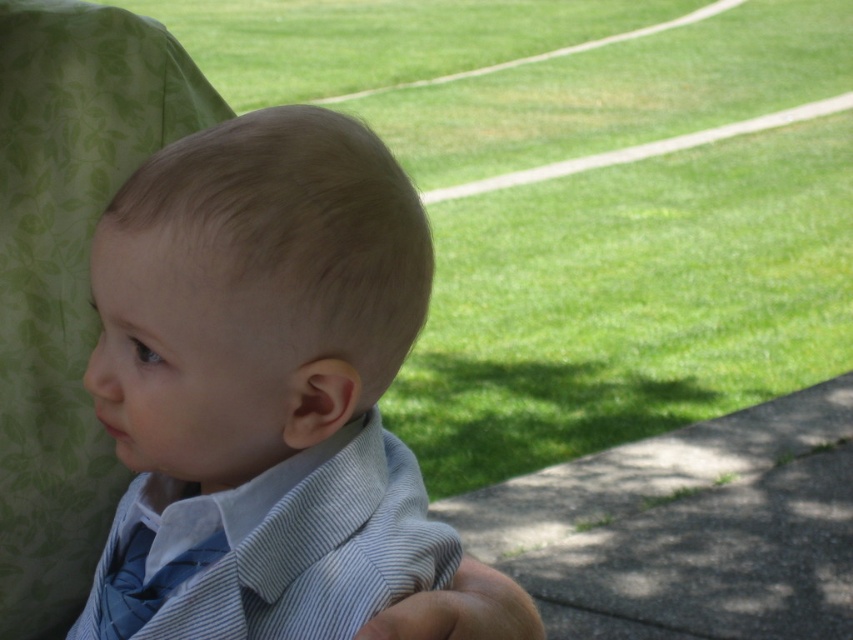
Based on the scene description, which object is positioned higher on the child? The light brown hair at center or the blue striped dress shirt at center?

The light brown hair at center is taller than the blue striped dress shirt at center.

You are a tailor who needs to adjust the blue striped dress shirt at center and the blue striped tie at lower left. Which item requires more horizontal space when laid flat?

The blue striped dress shirt at center requires more horizontal space when laid flat because it might be wider than the blue striped tie at lower left.